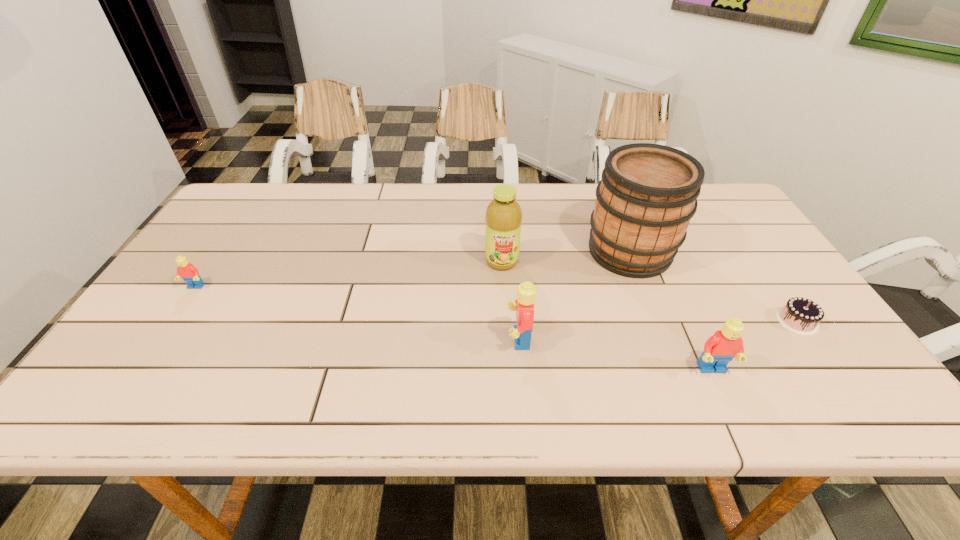
Identify the location of vacant space at the left edge. The image size is (960, 540). (215, 250).

I want to click on free point at the right edge, so click(x=765, y=247).

At what (x,y) coordinates should I click in order to perform the action: click on free space at the far left corner of the desktop. Please return your answer as a coordinate pair (x, y). The height and width of the screenshot is (540, 960). Looking at the image, I should click on (221, 219).

I want to click on empty space between the cider and the second Lego from right to left, so click(x=574, y=295).

Where is `empty location between the cider and the chocolate cake`? The width and height of the screenshot is (960, 540). empty location between the cider and the chocolate cake is located at coordinates (713, 286).

Locate an element on the screen. Image resolution: width=960 pixels, height=540 pixels. free space that is in between the second nearest Lego and the nearest Lego is located at coordinates (615, 354).

Identify the location of free space that is in between the nearest object and the cider. This screenshot has height=540, width=960. (671, 310).

Find the location of a particular element. This screenshot has width=960, height=540. vacant area that lies between the nearest Lego and the second tallest object is located at coordinates (607, 315).

You are a GUI agent. You are given a task and a screenshot of the screen. Output one action in this format:
    pyautogui.click(x=<x>, y=<y>)
    Task: Click on the empty space that is in between the second nearest Lego and the cider
    
    Given the screenshot: What is the action you would take?
    pyautogui.click(x=574, y=295)

What are the coordinates of `free point between the second tallest Lego and the leftmost object` in the screenshot? It's located at (454, 328).